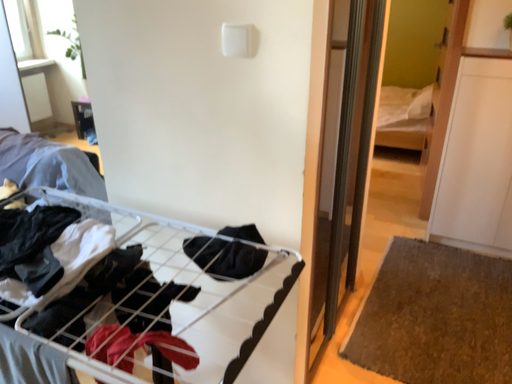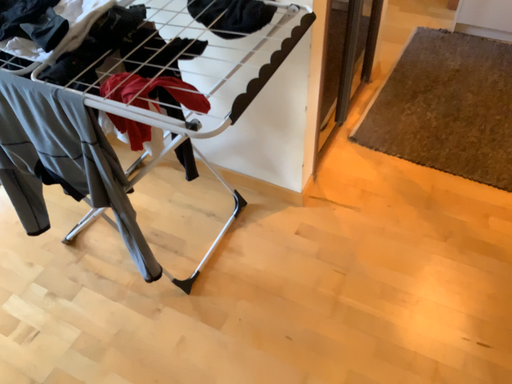
Question: How did the camera likely rotate when shooting the video?

Choices:
 (A) rotated downward
 (B) rotated upward

Answer: (A)